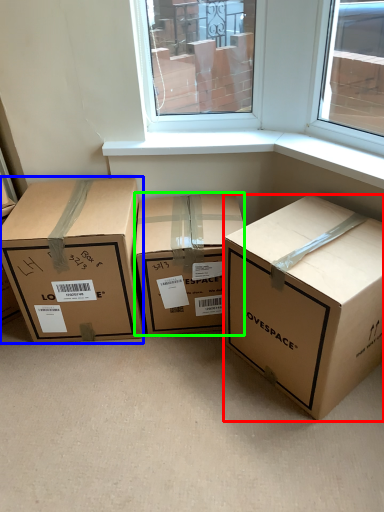
Question: Which object is the closest to the box (highlighted by a red box)? Choose among these: box (highlighted by a blue box) or box (highlighted by a green box).

Choices:
 (A) box
 (B) box

Answer: (B)